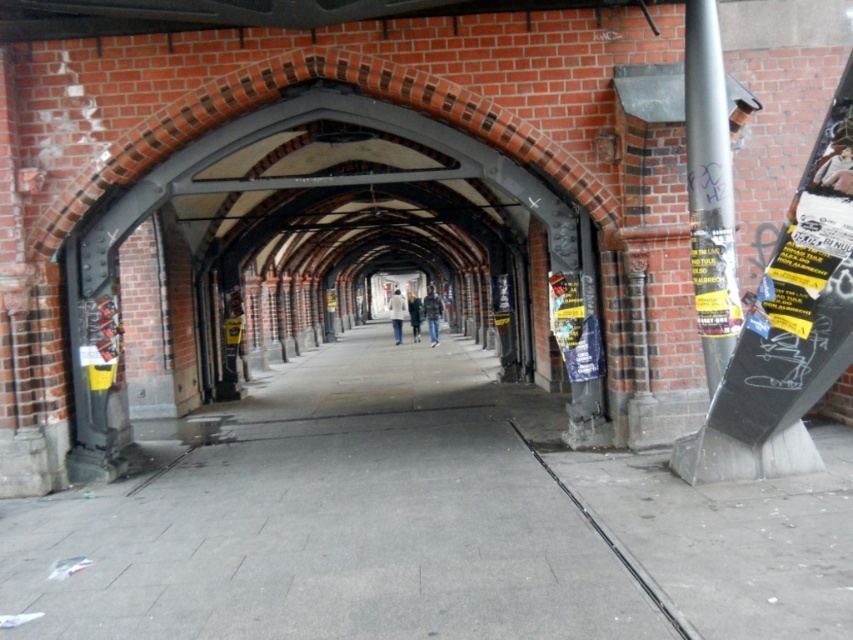
Question: Does silver metallic pole at right have a larger size compared to dark blue jeans at center?

Choices:
 (A) yes
 (B) no

Answer: (B)

Question: Does silver metallic pole at right have a larger size compared to dark blue jeans at center?

Choices:
 (A) no
 (B) yes

Answer: (A)

Question: Can you confirm if silver metallic pole at right is positioned above white fabric coat at center?

Choices:
 (A) no
 (B) yes

Answer: (B)

Question: Which of the following is the closest to the observer?

Choices:
 (A) (173, 449)
 (B) (708, 129)
 (C) (434, 305)
 (D) (415, 310)

Answer: (B)

Question: Which of the following is the closest to the observer?

Choices:
 (A) silver metallic pole at right
 (B) gray concrete pavement at center

Answer: (B)

Question: Which point is farther to the camera?

Choices:
 (A) gray concrete pavement at center
 (B) light beige coat at center
 (C) silver metallic pole at right

Answer: (B)